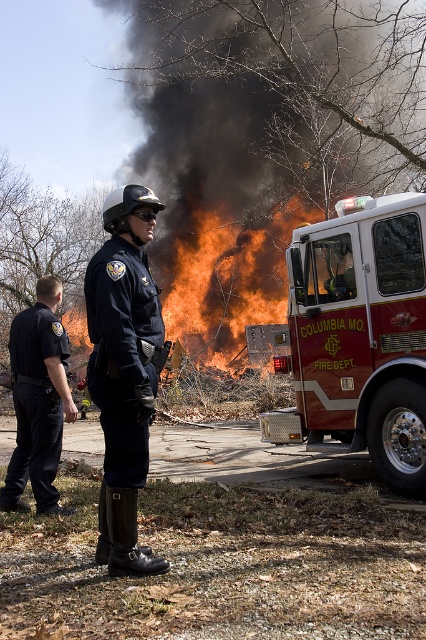
You are a firefighter assessing the scene. You see the matte black uniform at center and the flame orange fire at center. Which object takes up more space in the image?

The flame orange fire at center takes up more space in the image because the matte black uniform at center has a smaller size compared to it.

You are a photographer trying to capture a clear shot of the red glossy fire truck at right and the black uniform pants at left. Which object should you focus on first if you want to ensure both are in focus, considering their positions?

The red glossy fire truck at right is located above the black uniform pants at left, so you should focus on the red glossy fire truck at right first to ensure both are in focus since it is closer to the camera.